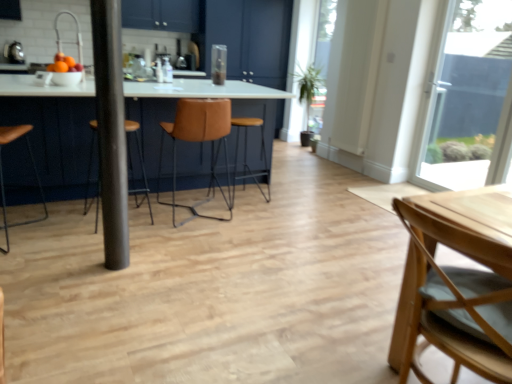
The height and width of the screenshot is (384, 512). I want to click on free location to the right of leather seat at center, so click(283, 197).